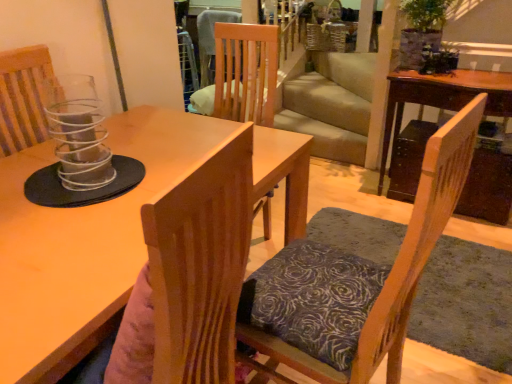
Question: Is wooden chair with patterned cushion at center, the 1th chair when ordered from right to left, shorter than matte wooden table at center, the 2th table from the right?

Choices:
 (A) no
 (B) yes

Answer: (A)

Question: Is wooden chair with patterned cushion at center, the 1th chair when ordered from right to left, further to the viewer compared to matte wooden table at center, which is the second table from back to front?

Choices:
 (A) yes
 (B) no

Answer: (A)

Question: From the image's perspective, is wooden chair with patterned cushion at center, the 1th chair when ordered from right to left, on matte wooden table at center, the 1th table in the left-to-right sequence?

Choices:
 (A) no
 (B) yes

Answer: (A)

Question: From a real-world perspective, is wooden chair with patterned cushion at center, the 1th chair when ordered from right to left, positioned under matte wooden table at center, which ranks as the first table in front-to-back order, based on gravity?

Choices:
 (A) no
 (B) yes

Answer: (B)

Question: Could matte wooden table at center, the 1th table in the left-to-right sequence, be considered to be inside wooden chair with patterned cushion at center, the 1th chair when ordered from right to left?

Choices:
 (A) no
 (B) yes

Answer: (A)

Question: Which is correct: clear glass candle holder at left is inside wooden table at right, which appears as the first table when viewed from the back, or outside of it?

Choices:
 (A) inside
 (B) outside

Answer: (B)

Question: Is point (70, 117) closer or farther from the camera than point (450, 94)?

Choices:
 (A) farther
 (B) closer

Answer: (B)

Question: In the image, is clear glass candle holder at left positioned in front of or behind wooden table at right, which is the first table from right to left?

Choices:
 (A) front
 (B) behind

Answer: (A)

Question: From a real-world perspective, is clear glass candle holder at left positioned above or below wooden table at right, arranged as the second table when viewed from the left?

Choices:
 (A) above
 (B) below

Answer: (A)

Question: Is matte wooden table at center, which ranks as the first table in front-to-back order, bigger or smaller than transparent plastic chair at upper left, placed as the 2th chair when sorted from right to left?

Choices:
 (A) small
 (B) big

Answer: (A)

Question: From the image's perspective, relative to transparent plastic chair at upper left, the 1th chair viewed from the left, is matte wooden table at center, the 1th table in the left-to-right sequence, above or below?

Choices:
 (A) below
 (B) above

Answer: (A)

Question: Considering their positions, is matte wooden table at center, which is the second table from back to front, located in front of or behind transparent plastic chair at upper left, placed as the 2th chair when sorted from right to left?

Choices:
 (A) behind
 (B) front

Answer: (B)

Question: Is point (38, 210) positioned closer to the camera than point (12, 69)?

Choices:
 (A) farther
 (B) closer

Answer: (B)

Question: Relative to wooden chair with patterned cushion at center, the 1th chair when ordered from right to left, is wooden table at right, arranged as the second table when viewed from the left, in front or behind?

Choices:
 (A) behind
 (B) front

Answer: (A)

Question: Looking at the image, does wooden table at right, which appears as the first table when viewed from the back, seem bigger or smaller compared to wooden chair with patterned cushion at center, the 2th chair from the left?

Choices:
 (A) small
 (B) big

Answer: (B)